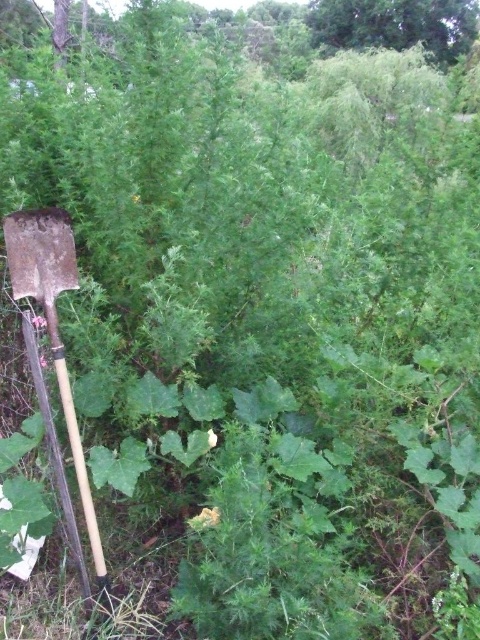
You are standing at the lower left corner of the image where the shovel is located. You want to walk towards the point at coordinates point (x=472, y=35). However, there are dense shrubs blocking your path. Can you see the point at point (x=73, y=417) from your current position?

Yes, because point (x=73, y=417) is in front of point (x=472, y=35), so it is closer to your current position and not blocked by the dense shrubs.

You are a gardener who needs to reach the green leafy tree at upper center to prune its branches. However, there is a wooden shovel at left in your way. Can you move the shovel to access the tree?

The wooden shovel at left is in front of the green leafy tree at upper center, so you can move the shovel to access the tree.